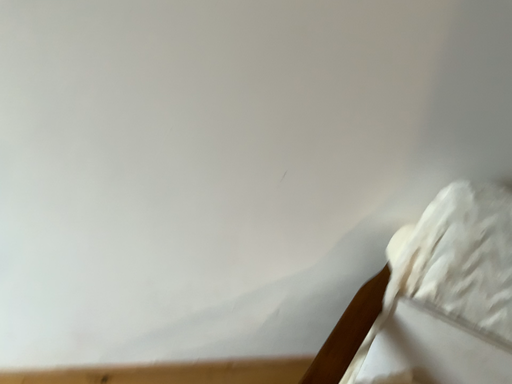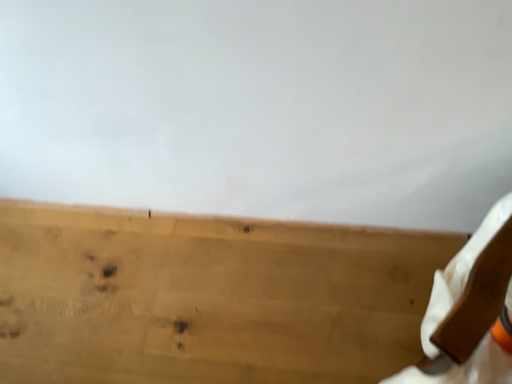
Question: Which way did the camera rotate in the video?

Choices:
 (A) rotated downward
 (B) rotated upward

Answer: (A)